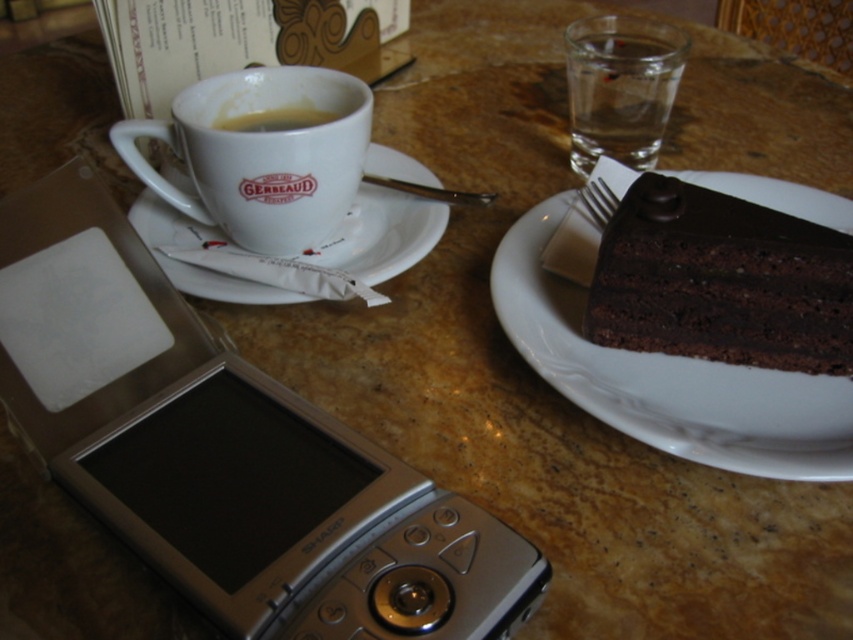
Based on the photo, is white ceramic mug at upper left smaller than metallic silver fork at upper right?

No.

Can you confirm if white ceramic mug at upper left is wider than metallic silver fork at upper right?

Correct, the width of white ceramic mug at upper left exceeds that of metallic silver fork at upper right.

Find the location of a particular element. The height and width of the screenshot is (640, 853). white ceramic mug at upper left is located at coordinates (260, 154).

Does dark chocolate cake at right appear on the left side of matte ceramic cup at upper left?

In fact, dark chocolate cake at right is to the right of matte ceramic cup at upper left.

Who is higher up, dark chocolate cake at right or matte ceramic cup at upper left?

matte ceramic cup at upper left is higher up.

Identify the location of dark chocolate cake at right. This screenshot has height=640, width=853. (721, 282).

The width and height of the screenshot is (853, 640). I want to click on dark chocolate cake at right, so click(x=721, y=282).

Does point (287, 124) lie in front of point (592, 214)?

No, (287, 124) is behind (592, 214).

Locate an element on the screen. matte ceramic cup at upper left is located at coordinates (276, 120).

At what (x,y) coordinates should I click in order to perform the action: click on matte ceramic cup at upper left. Please return your answer as a coordinate pair (x, y). The height and width of the screenshot is (640, 853). Looking at the image, I should click on (276, 120).